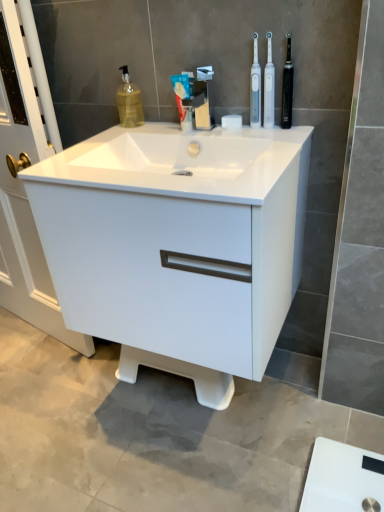
Where is `vacant space in front of white plastic toothbrush at upper right, the second toothbrush positioned from the right`? This screenshot has height=512, width=384. vacant space in front of white plastic toothbrush at upper right, the second toothbrush positioned from the right is located at coordinates (270, 135).